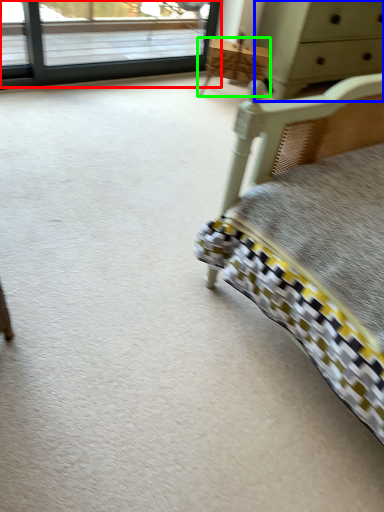
Question: Which object is the farthest from window (highlighted by a red box)? Choose among these: chest of drawers (highlighted by a blue box) or furniture (highlighted by a green box).

Choices:
 (A) chest of drawers
 (B) furniture

Answer: (A)